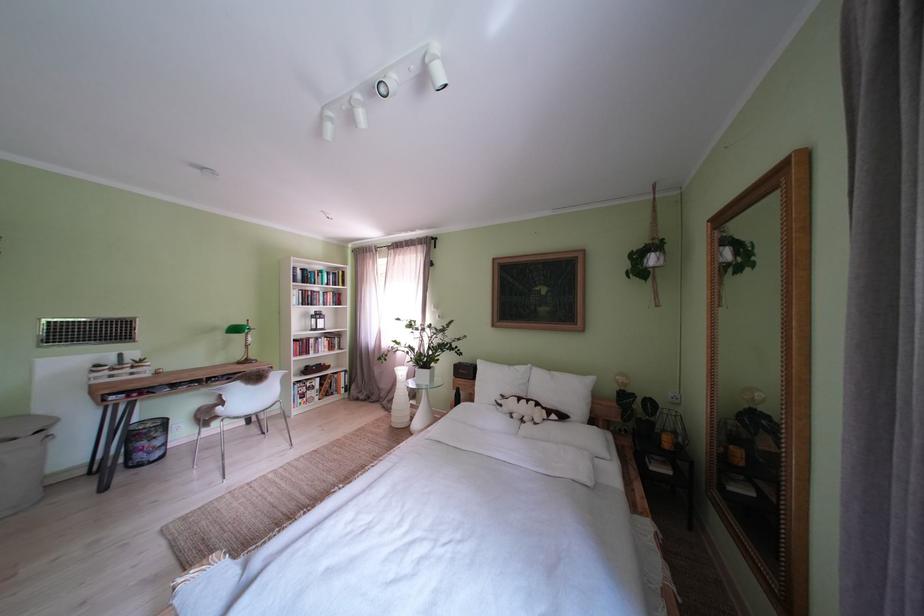
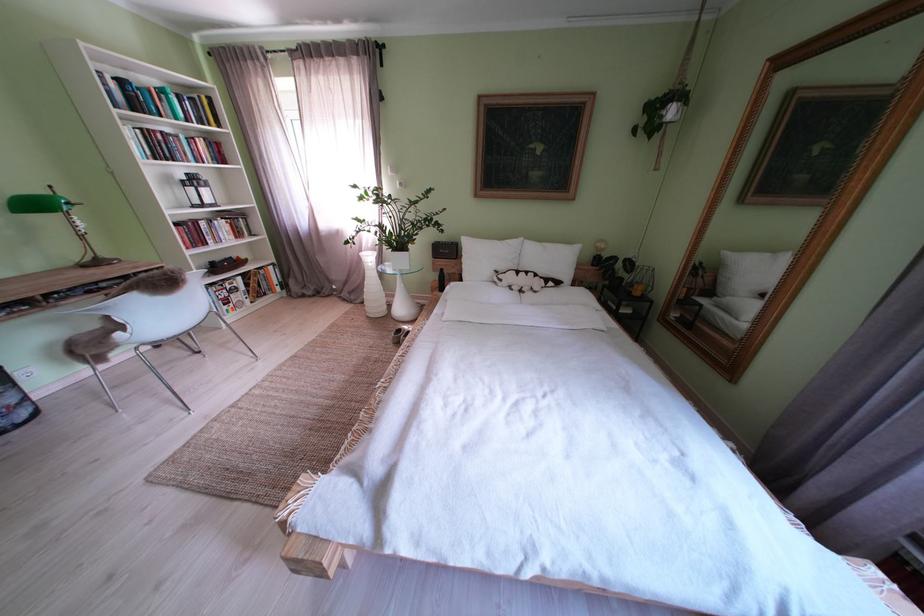
Find the pixel in the second image that matches (500,386) in the first image.

(490, 262)